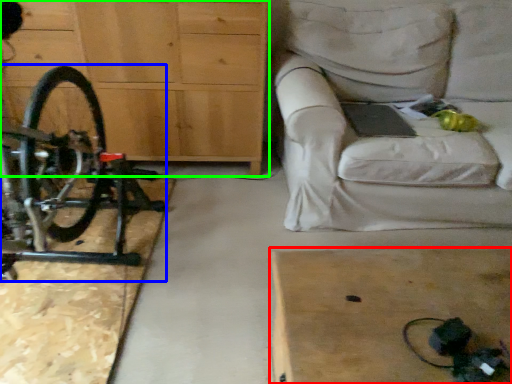
Question: Considering the real-world distances, which object is closest to table (highlighted by a red box)? bicycle (highlighted by a blue box) or chest of drawers (highlighted by a green box).

Choices:
 (A) bicycle
 (B) chest of drawers

Answer: (A)